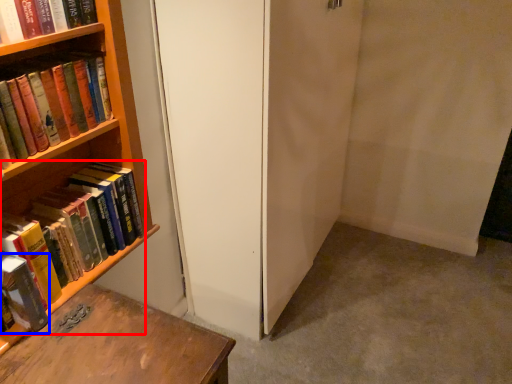
Question: Among these objects, which one is nearest to the camera, book (highlighted by a red box) or book (highlighted by a blue box)?

Choices:
 (A) book
 (B) book

Answer: (B)